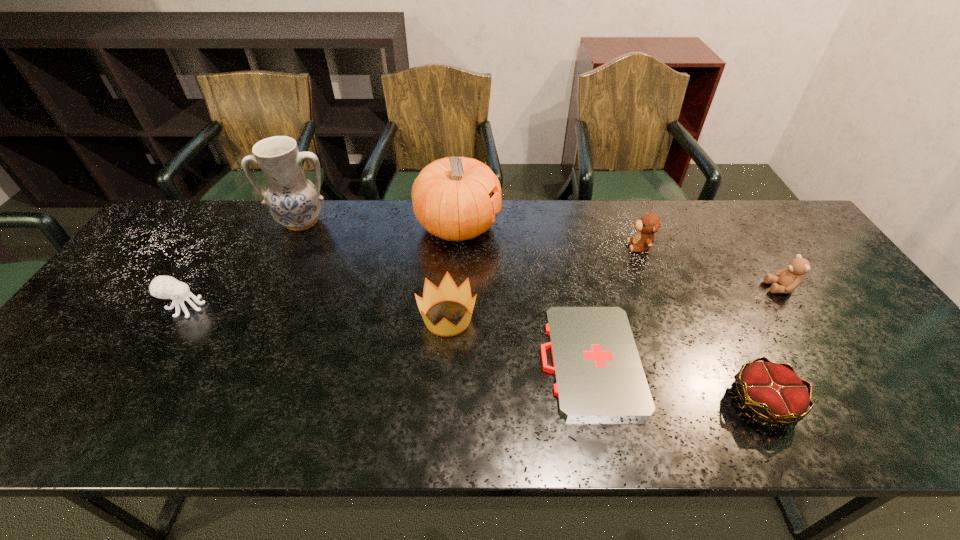
Where is `the shorter crown`? Image resolution: width=960 pixels, height=540 pixels. the shorter crown is located at coordinates (772, 391).

Locate an element on the screen. The width and height of the screenshot is (960, 540). the fourth object from right to left is located at coordinates (598, 373).

Find the location of `the first-aid kit`. the first-aid kit is located at coordinates (598, 373).

Locate an element on the screen. The height and width of the screenshot is (540, 960). free space located on the left of the seventh object from right to left is located at coordinates (219, 222).

Where is `free region located on the front-facing side of the pumpkin`? This screenshot has width=960, height=540. free region located on the front-facing side of the pumpkin is located at coordinates (576, 226).

Find the location of a particular element. The width and height of the screenshot is (960, 540). vacant space located on the face of the sixth object from left to right is located at coordinates (611, 246).

Locate an element on the screen. free space located 0.240m on the face of the sixth object from left to right is located at coordinates coord(548,246).

This screenshot has height=540, width=960. What are the coordinates of `free space located on the face of the sixth object from left to right` in the screenshot? It's located at (495, 246).

Identify the location of free space located on the front-facing side of the leftmost object. (284, 308).

Identify the location of vacant position located on the face of the nearer teddy bear. The image size is (960, 540). point(705,288).